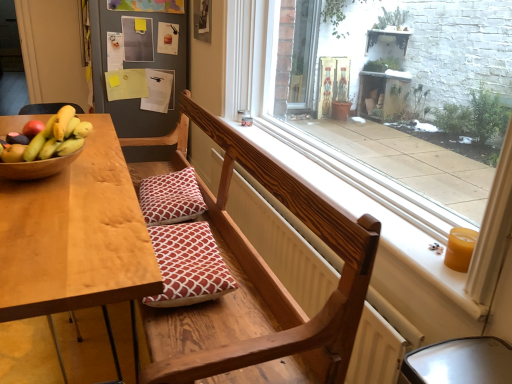
At what (x,y) coordinates should I click in order to perform the action: click on empty space that is ontop of wooden bowl at left. Please return your answer as a coordinate pair (x, y). This screenshot has height=384, width=512. Looking at the image, I should click on pos(42,141).